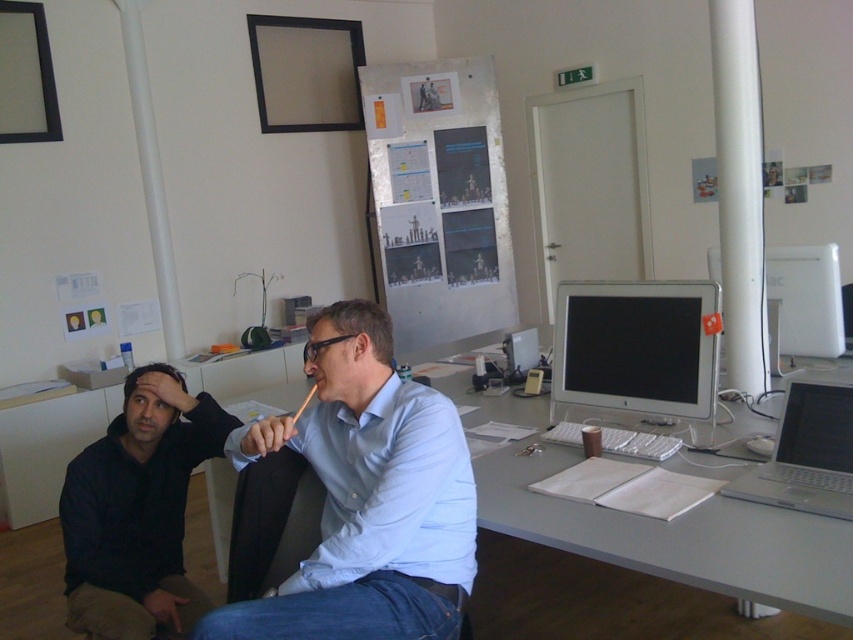
You are an office assistant who needs to determine which object occupies more space in the foreground of the image. Which one is larger between the light blue shirt at center and the white glossy monitor at center?

The light blue shirt at center is bigger than the white glossy monitor at center, so the light blue shirt at center occupies more space in the foreground.

You are standing in front of the office desk where two men are seated. There are two points marked in the image. The first point is at coordinates point (161, 490) and the second point is at point (770, 268). Which of these two points is closer to you?

The point at coordinates point (161, 490) is closer to the viewer than point (770, 268).

You are organizing the desk and need to place a new item between the dark blue hoodie at lower left and the white glossy computer monitor at right. Based on their current positions, which side of the hoodie should you place the new item to keep it aligned with the monitor?

The dark blue hoodie at lower left is positioned on the left side of the white glossy computer monitor at right. To align the new item with the monitor, place it to the right of the dark blue hoodie at lower left.